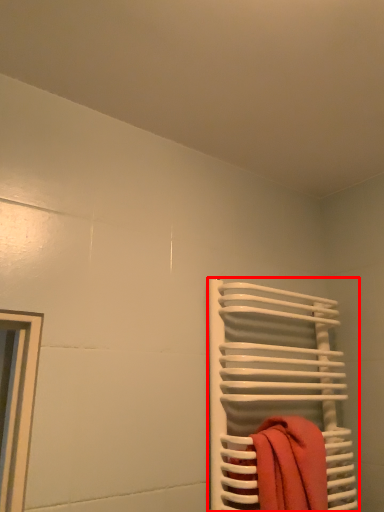
Question: From the image's perspective, where is towel rack (annotated by the red box) located in relation to beach towel in the image?

Choices:
 (A) below
 (B) above

Answer: (B)